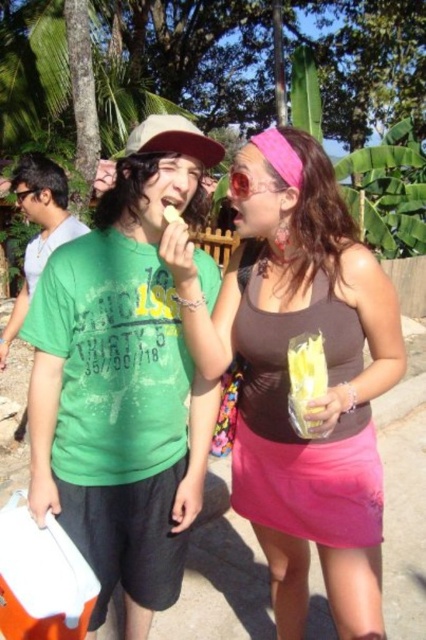
Question: Does green matte t-shirt at left appear over matte plastic mouth at center?

Choices:
 (A) no
 (B) yes

Answer: (A)

Question: Which of the following is the closest to the observer?

Choices:
 (A) (230, 208)
 (B) (175, 220)
 (C) (55, 189)
 (D) (359, 452)

Answer: (B)

Question: Which point is farther to the camera?

Choices:
 (A) (299, 397)
 (B) (175, 218)
 (C) (34, 433)
 (D) (51, 212)

Answer: (D)

Question: Considering the real-world distances, which object is closest to the pink fabric skirt at center?

Choices:
 (A) yellow matte food at mouth
 (B) green matte shirt at center
 (C) matte skin at mouth center

Answer: (B)

Question: Does pink fabric skirt at center have a smaller size compared to matte plastic mouth at center?

Choices:
 (A) yes
 (B) no

Answer: (B)

Question: Observing the image, what is the correct spatial positioning of pink fabric skirt at center in reference to yellow matte food at mouth?

Choices:
 (A) above
 (B) below

Answer: (B)